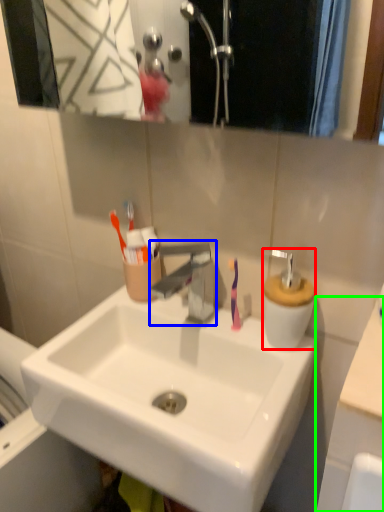
Question: Which is farther away from soap dispenser (highlighted by a red box)? tap (highlighted by a blue box) or counter top (highlighted by a green box)?

Choices:
 (A) tap
 (B) counter top

Answer: (B)